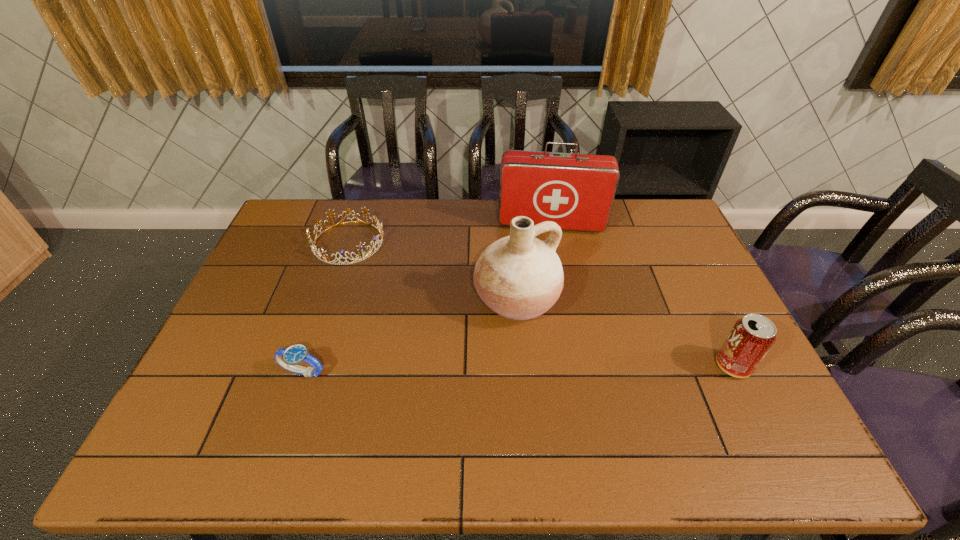
The height and width of the screenshot is (540, 960). Find the location of `vacant space on the desktop that is between the watch and the soda can and is positioned to pour from the handle of the third nearest object`. vacant space on the desktop that is between the watch and the soda can and is positioned to pour from the handle of the third nearest object is located at coordinates (570, 368).

The width and height of the screenshot is (960, 540). I want to click on free space on the desktop that is between the watch and the soda can and is positioned on the side of the first-aid kit with the first aid cross symbol, so click(x=552, y=368).

Find the location of `vacant space on the desktop that is between the watch and the third tallest object and is positioned on the front-facing side of the tiara`. vacant space on the desktop that is between the watch and the third tallest object and is positioned on the front-facing side of the tiara is located at coordinates (458, 370).